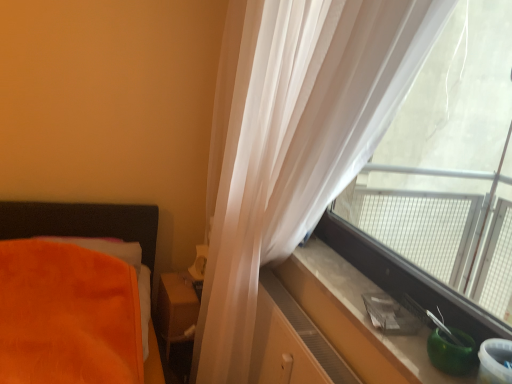
Question: From the image's perspective, is smooth concrete window sill at right located above or below transparent plastic window at right?

Choices:
 (A) above
 (B) below

Answer: (B)

Question: Visually, is smooth concrete window sill at right positioned to the left or to the right of transparent plastic window at right?

Choices:
 (A) left
 (B) right

Answer: (A)

Question: Based on their relative distances, which object is farther from the translucent white curtain at upper right?

Choices:
 (A) matte brown wooden table at center
 (B) transparent plastic window at right
 (C) smooth concrete window sill at right
 (D) matte wood dresser at lower right

Answer: (A)

Question: Estimate the real-world distances between objects in this image. Which object is farther from the transparent plastic window at right?

Choices:
 (A) smooth concrete window sill at right
 (B) translucent white curtain at upper right
 (C) matte brown wooden table at center
 (D) matte wood dresser at lower right

Answer: (C)